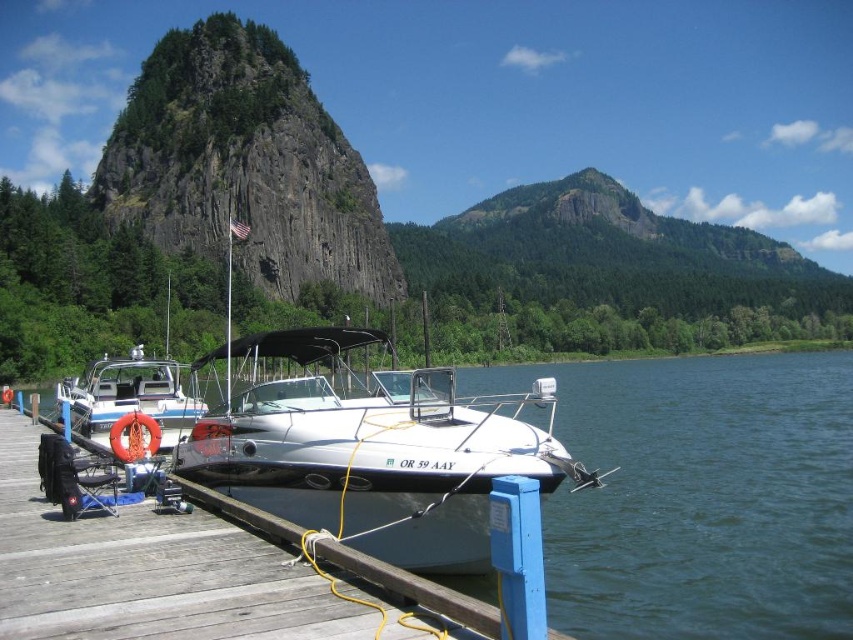
Question: Does rugged stone mountain at upper left appear under white glossy boat at left?

Choices:
 (A) yes
 (B) no

Answer: (B)

Question: Which of these objects is positioned closest to the wooden dock at lower left?

Choices:
 (A) white glossy boat at center
 (B) rugged stone mountain at upper left

Answer: (A)

Question: Is white glossy boat at center behind rugged stone mountain at upper left?

Choices:
 (A) yes
 (B) no

Answer: (B)

Question: Among these points, which one is nearest to the camera?

Choices:
 (A) (482, 500)
 (B) (190, 403)

Answer: (A)

Question: Is white glossy boat at center above white glossy boat at left?

Choices:
 (A) no
 (B) yes

Answer: (A)

Question: Which object is positioned farthest from the white glossy boat at center?

Choices:
 (A) rugged stone mountain at upper left
 (B) white glossy boat at left

Answer: (A)